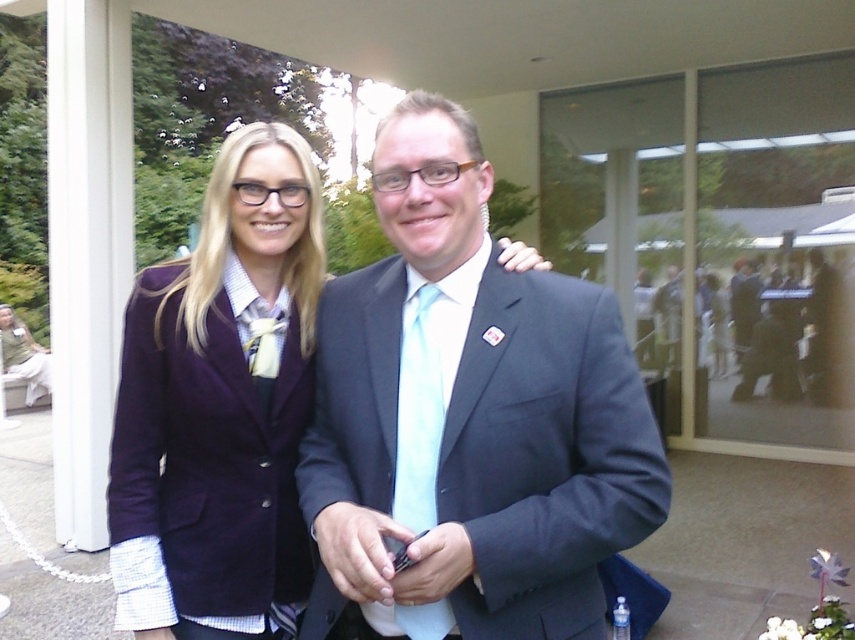
You are standing in front of the two people in the image. Which person is wearing a matte black suit at center located at point [469,419]?

The man dressed in a dark suit with a light blue tie and a white shirt is wearing the matte black suit at center located at point [469,419].

You are organizing a charity event and need to ensure all guests are wearing formal attire. You notice two guests wearing the matte black suit at center and the purple velvet blazer at center. Which guest is wearing a larger formal outfit?

The matte black suit at center is bigger than the purple velvet blazer at center, so the guest wearing the matte black suit at center has the larger formal outfit.

You are a photographer at a formal event and need to position a spotlight exactly at the center of the matte black suit at center. According to the coordinates provided, what are the exact coordinates where you should place the spotlight?

The exact coordinates to place the spotlight on the matte black suit at center are at point (469, 419).